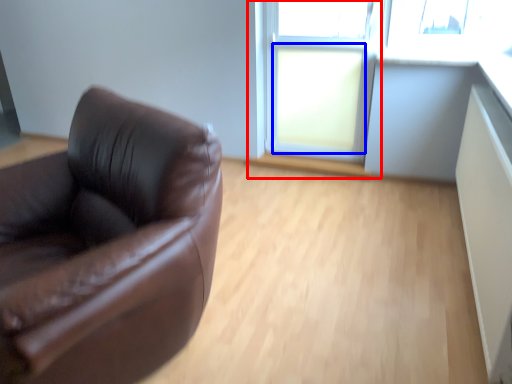
Question: Which of the following is the farthest to the observer, window frame (highlighted by a red box) or window (highlighted by a blue box)?

Choices:
 (A) window frame
 (B) window

Answer: (B)